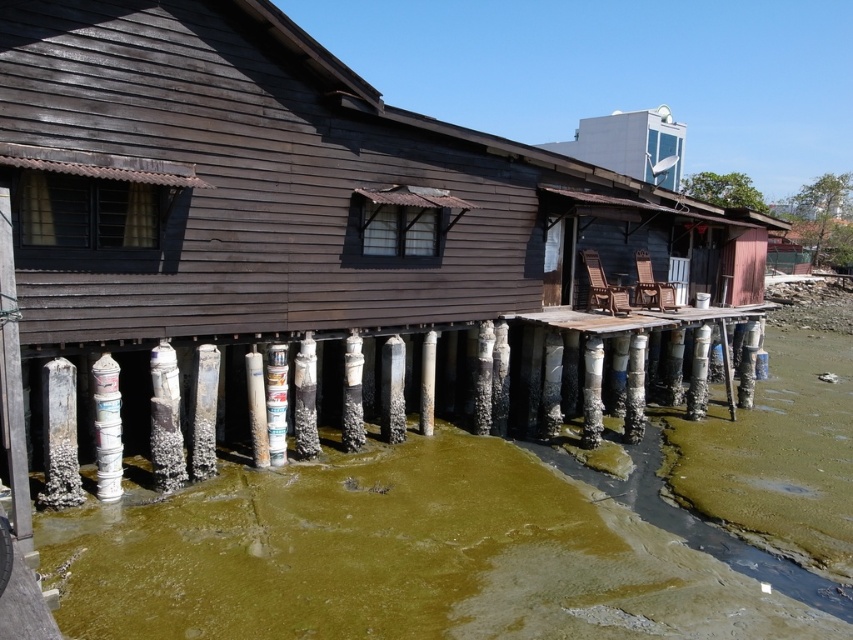
Does point (398, 420) lie behind point (265, 412)?

That is True.

What do you see at coordinates (392, 390) in the screenshot? I see `white weathered wood post at center` at bounding box center [392, 390].

Is point (397, 372) farther from camera compared to point (283, 396)?

Yes.

This screenshot has width=853, height=640. What are the coordinates of `white weathered wood post at center` in the screenshot? It's located at (392, 390).

Describe the element at coordinates (421, 554) in the screenshot. The image size is (853, 640). I see `green algae mud at lower center` at that location.

Can you confirm if green algae mud at lower center is positioned below white painted wood pillar at lower left?

Correct, green algae mud at lower center is located below white painted wood pillar at lower left.

Measure the distance between point (511,618) and camera.

They are 19.60 feet apart.

The width and height of the screenshot is (853, 640). I want to click on green algae mud at lower center, so click(x=421, y=554).

Can you confirm if green algae mud at lower center is positioned to the right of white glossy satellite dish at upper center?

In fact, green algae mud at lower center is to the left of white glossy satellite dish at upper center.

Where is `green algae mud at lower center`? green algae mud at lower center is located at coordinates coord(421,554).

I want to click on green algae mud at lower center, so click(x=421, y=554).

At what (x,y) coordinates should I click in order to perform the action: click on green algae mud at lower center. Please return your answer as a coordinate pair (x, y). This screenshot has height=640, width=853. Looking at the image, I should click on (x=421, y=554).